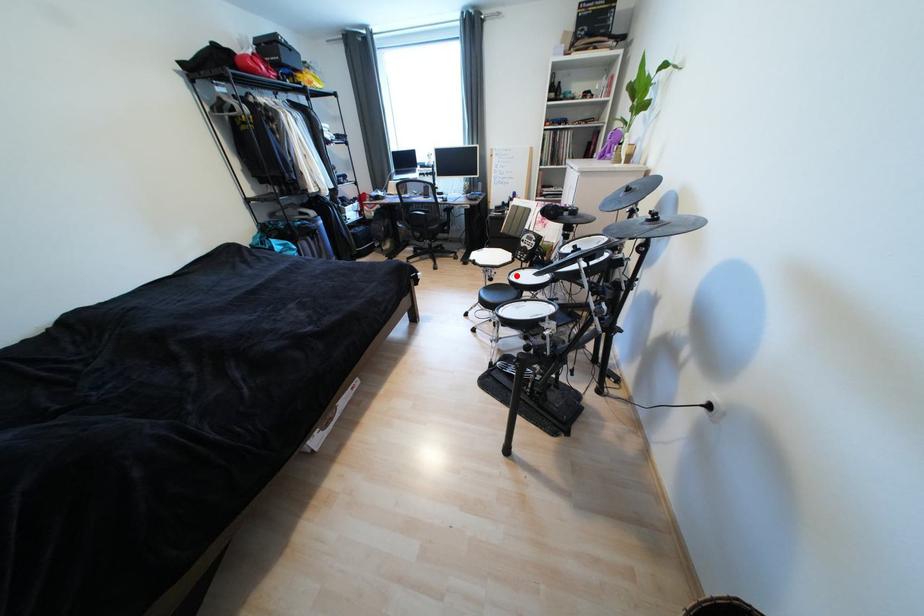
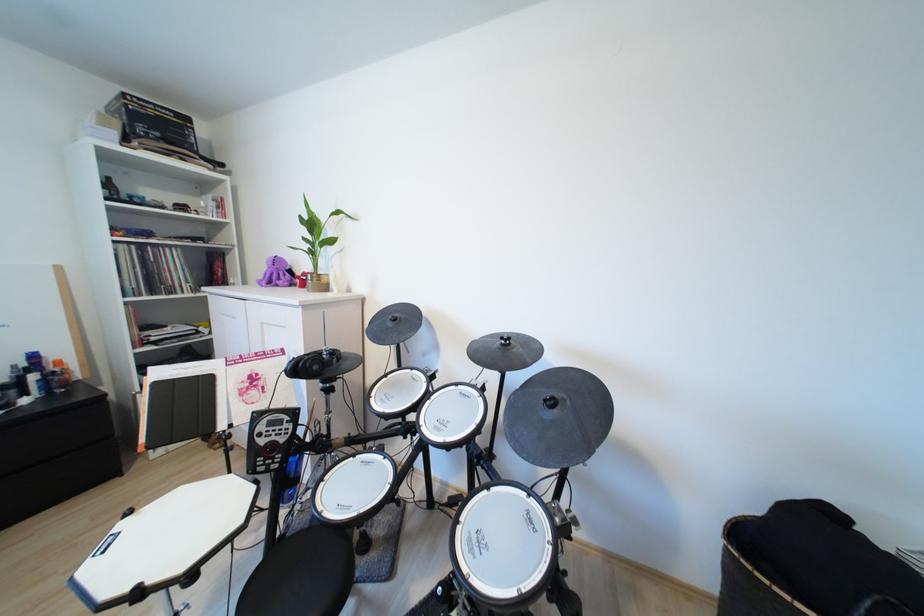
Question: I am providing you with two images of the same scene from different viewpoints. A red point is marked on the first image. At the location where the point appears in image 1, is it still visible in image 2?

Choices:
 (A) Yes
 (B) No

Answer: (A)